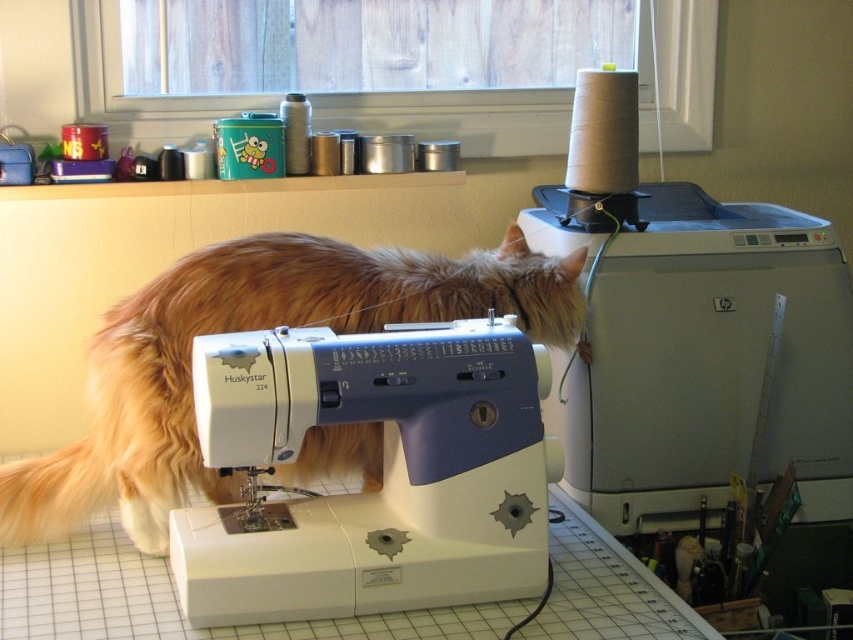
Is white plastic sewing machine at center taller than golden fur cat at center?

Incorrect, white plastic sewing machine at center's height is not larger of golden fur cat at center's.

Between point (450, 576) and point (358, 301), which one is positioned in front?

Point (450, 576) is more forward.

Who is more distant from viewer, (421, 396) or (370, 289)?

Positioned behind is point (370, 289).

This screenshot has height=640, width=853. I want to click on white plastic sewing machine at center, so click(384, 472).

Who is shorter, white plastic sewing machine at upper right or golden fur cat at center?

With less height is golden fur cat at center.

Is point (589, 413) positioned after point (376, 480)?

Yes, point (589, 413) is farther from viewer.

At what (x,y) coordinates should I click in order to perform the action: click on white plastic sewing machine at upper right. Please return your answer as a coordinate pair (x, y). Looking at the image, I should click on point(693,333).

Is point (782, 376) behind point (254, 605)?

Yes, point (782, 376) is farther from viewer.

Could you measure the distance between white plastic sewing machine at upper right and white plastic sewing machine at center?

They are 18.44 inches apart.

Does point (659, 320) lie in front of point (526, 481)?

No.

In order to click on white plastic sewing machine at upper right in this screenshot , I will do `click(693, 333)`.